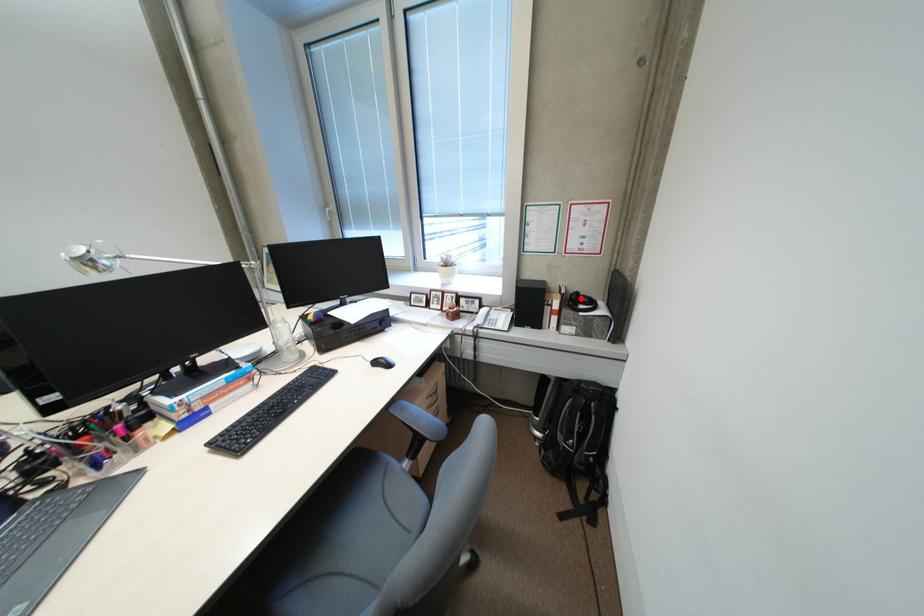
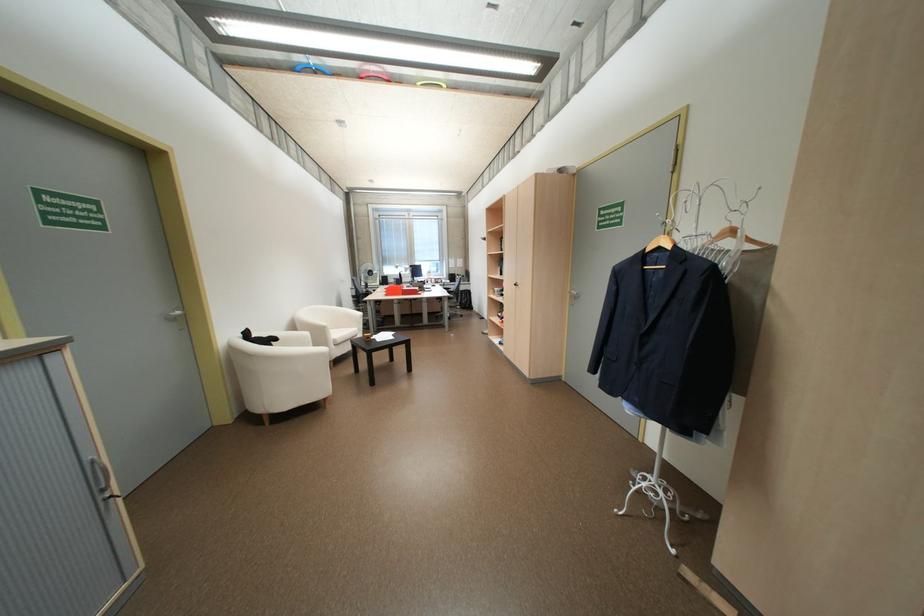
Question: I am providing you with two images of the same scene from different viewpoints. A red point is marked on the first image. At the location where the point appears in image 1, is it still visible in image 2?

Choices:
 (A) Yes
 (B) No

Answer: (B)